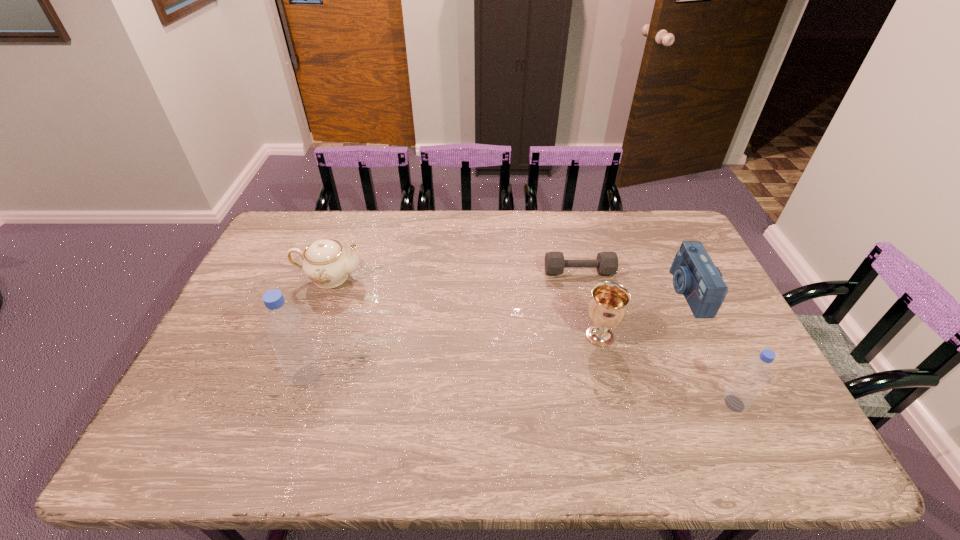
The height and width of the screenshot is (540, 960). I want to click on vacant space that is in between the right bottle and the fourth farthest object, so click(x=667, y=370).

Locate an element on the screen. free space between the right bottle and the shortest object is located at coordinates (657, 338).

The width and height of the screenshot is (960, 540). In order to click on free spot between the fifth farthest object and the camera in this screenshot , I will do `click(497, 334)`.

The height and width of the screenshot is (540, 960). Find the location of `empty space that is in between the chinaware and the camera`. empty space that is in between the chinaware and the camera is located at coordinates (509, 285).

Image resolution: width=960 pixels, height=540 pixels. I want to click on vacant space in between the third nearest object and the chinaware, so click(465, 307).

This screenshot has width=960, height=540. What are the coordinates of `object that stands as the fourth closest to the dumbbell` in the screenshot? It's located at (325, 262).

This screenshot has width=960, height=540. In order to click on the third closest object relative to the farther bottle in this screenshot , I will do `click(606, 263)`.

Find the location of a particular element. Image resolution: width=960 pixels, height=540 pixels. free space that satisfies the following two spatial constraints: 1. at the spout of the third nearest object; 2. on the right side of the chinaware is located at coordinates (308, 336).

This screenshot has width=960, height=540. What are the coordinates of `free point that satisfies the following two spatial constraints: 1. at the spout of the farther bottle; 2. on the right side of the chinaware` in the screenshot? It's located at (294, 376).

This screenshot has height=540, width=960. Find the location of `free location that satisfies the following two spatial constraints: 1. at the spout of the chinaware; 2. on the back side of the second tallest object`. free location that satisfies the following two spatial constraints: 1. at the spout of the chinaware; 2. on the back side of the second tallest object is located at coordinates (283, 403).